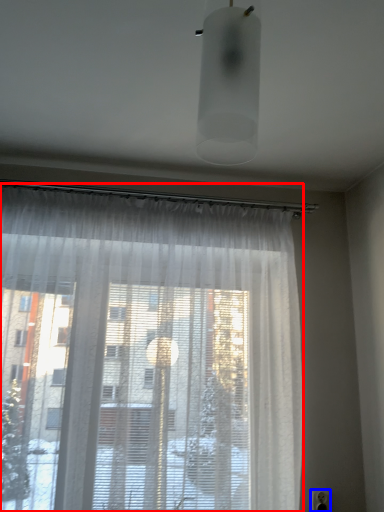
Question: Which object is further to the camera taking this photo, curtain (highlighted by a red box) or electric outlet (highlighted by a blue box)?

Choices:
 (A) curtain
 (B) electric outlet

Answer: (B)